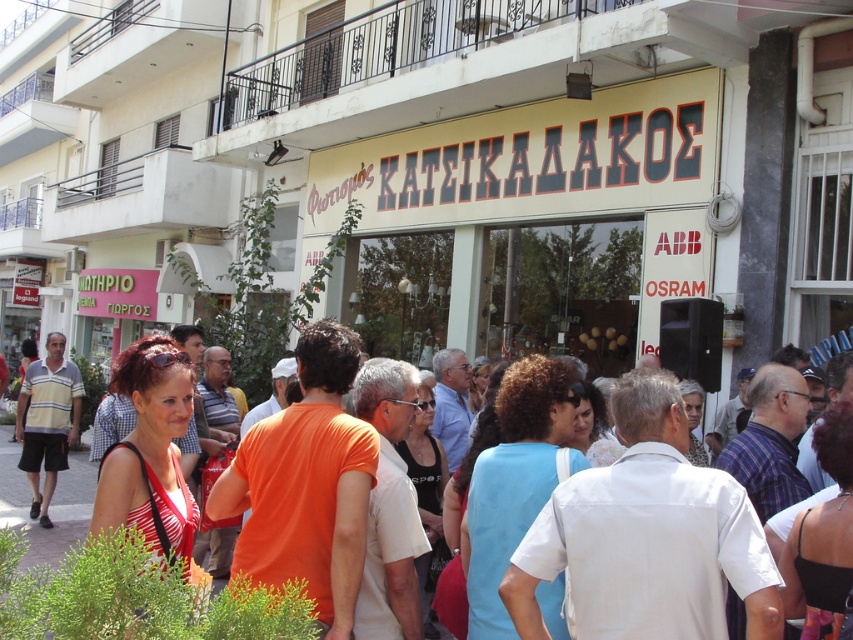
Is orange t-shirt at center bigger than striped cotton shirt at left?

Actually, orange t-shirt at center might be smaller than striped cotton shirt at left.

Can you confirm if orange t-shirt at center is smaller than striped cotton shirt at left?

Correct, orange t-shirt at center occupies less space than striped cotton shirt at left.

Is point (126, 541) positioned in front of point (39, 516)?

Yes.

You are a GUI agent. You are given a task and a screenshot of the screen. Output one action in this format:
    pyautogui.click(x=<x>, y=<y>)
    Task: Click on the orange t-shirt at center
    The image size is (853, 640).
    Given the screenshot: What is the action you would take?
    pyautogui.click(x=131, y=598)